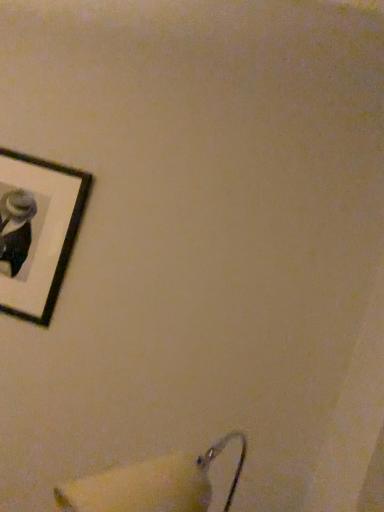
Where is `black matte picture frame at upper left`? black matte picture frame at upper left is located at coordinates (37, 231).

Image resolution: width=384 pixels, height=512 pixels. What do you see at coordinates (37, 231) in the screenshot?
I see `black matte picture frame at upper left` at bounding box center [37, 231].

Locate an element on the screen. This screenshot has width=384, height=512. black matte picture frame at upper left is located at coordinates (37, 231).